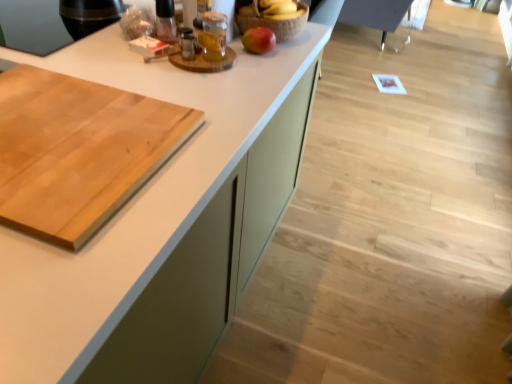
Question: From the image's perspective, relative to red matte apple at upper center, is natural wood cutting board at left above or below?

Choices:
 (A) above
 (B) below

Answer: (B)

Question: In the image, is natural wood cutting board at left on the left side or the right side of red matte apple at upper center?

Choices:
 (A) right
 (B) left

Answer: (B)

Question: Which is nearer to the white matte countertop at center?

Choices:
 (A) natural wood cutting board at left
 (B) red matte apple at upper center
 (C) translucent glass jar at upper center

Answer: (A)

Question: Which object is the closest to the translucent glass jar at upper center?

Choices:
 (A) white matte countertop at center
 (B) natural wood cutting board at left
 (C) red matte apple at upper center

Answer: (C)